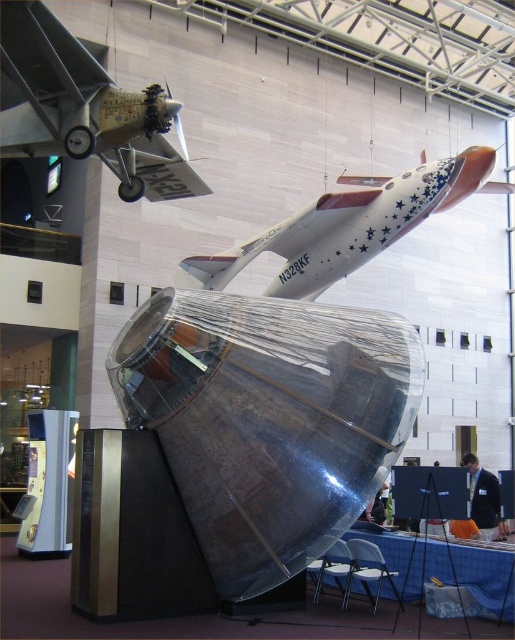
Identify the location of shiny metallic spacecraft at center. (267, 419).

Can you confirm if shiny metallic spacecraft at center is wider than brushed metal airplane at upper left?

Indeed, shiny metallic spacecraft at center has a greater width compared to brushed metal airplane at upper left.

Identify the location of shiny metallic spacecraft at center. (267, 419).

Locate an element on the screen. Image resolution: width=515 pixels, height=640 pixels. shiny metallic spacecraft at center is located at coordinates (267, 419).

What do you see at coordinates (267, 419) in the screenshot? I see `shiny metallic spacecraft at center` at bounding box center [267, 419].

Is shiny metallic spacecraft at center below white glossy airplane at upper center?

Yes.

This screenshot has width=515, height=640. I want to click on shiny metallic spacecraft at center, so click(267, 419).

Can you confirm if brushed metal airplane at upper left is taller than white glossy airplane at upper center?

No, brushed metal airplane at upper left is not taller than white glossy airplane at upper center.

Does brushed metal airplane at upper left have a larger size compared to white glossy airplane at upper center?

Incorrect, brushed metal airplane at upper left is not larger than white glossy airplane at upper center.

Where is `brushed metal airplane at upper left`? The width and height of the screenshot is (515, 640). brushed metal airplane at upper left is located at coordinates (85, 109).

You are a GUI agent. You are given a task and a screenshot of the screen. Output one action in this format:
    pyautogui.click(x=<x>, y=<y>)
    Task: Click on the brushed metal airplane at upper left
    This screenshot has width=515, height=640.
    Given the screenshot: What is the action you would take?
    pyautogui.click(x=85, y=109)